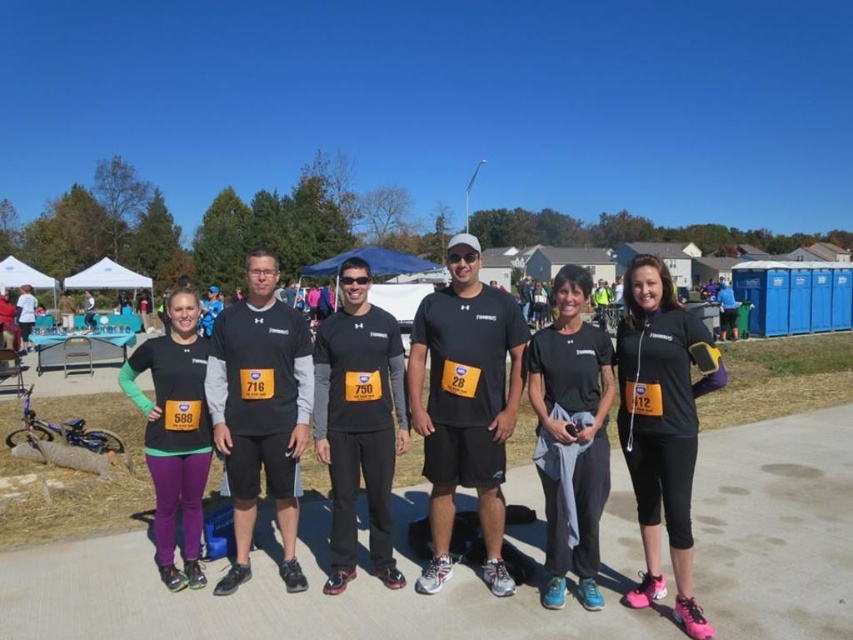
Question: Does black matte running shoes at lower right appear on the right side of black matte t-shirt at center?

Choices:
 (A) yes
 (B) no

Answer: (A)

Question: Considering the real-world distances, which object is farthest from the black matte running shoes at lower right?

Choices:
 (A) black matte t-shirt at center
 (B) purple matte leggings at center

Answer: (B)

Question: Which object appears closest to the camera in this image?

Choices:
 (A) black matte t-shirt at center
 (B) black matte running shoes at lower right
 (C) purple matte leggings at center

Answer: (B)

Question: Observing the image, what is the correct spatial positioning of black matte running shoes at lower right in reference to purple matte leggings at center?

Choices:
 (A) above
 (B) below

Answer: (A)

Question: Which object appears farthest from the camera in this image?

Choices:
 (A) purple matte leggings at center
 (B) black matte running shoes at lower right

Answer: (A)

Question: Does black matte running shoes at lower right have a larger size compared to black matte t-shirt at center?

Choices:
 (A) no
 (B) yes

Answer: (A)